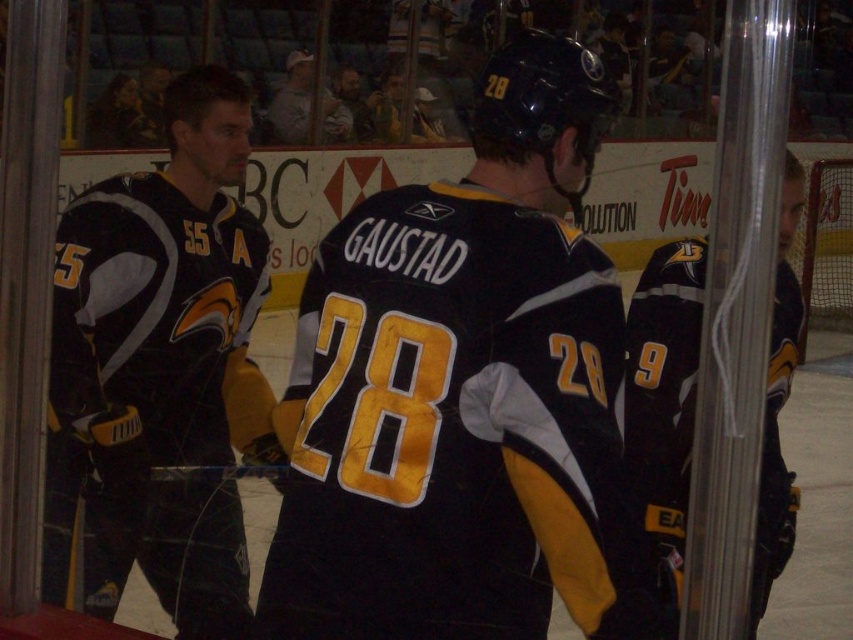
How distant is black matte jersey at right from gray cotton shirt at upper center?

black matte jersey at right is 8.76 meters from gray cotton shirt at upper center.

Who is higher up, black matte jersey at right or gray cotton shirt at upper center?

gray cotton shirt at upper center is above.

Is point (767, 483) positioned in front of point (306, 77)?

Yes, point (767, 483) is closer to viewer.

You are a GUI agent. You are given a task and a screenshot of the screen. Output one action in this format:
    pyautogui.click(x=<x>, y=<y>)
    Task: Click on the black matte jersey at right
    This screenshot has width=853, height=640.
    Given the screenshot: What is the action you would take?
    pyautogui.click(x=663, y=385)

Between black jersey at center and gray cotton shirt at upper center, which one appears on the right side from the viewer's perspective?

black jersey at center

Is black jersey at center closer to the viewer compared to gray cotton shirt at upper center?

Yes, black jersey at center is closer to the viewer.

At what (x,y) coordinates should I click in order to perform the action: click on black jersey at center. Please return your answer as a coordinate pair (x, y). The width and height of the screenshot is (853, 640). Looking at the image, I should click on (463, 394).

Is black jersey at center positioned in front of black jersey at left?

Yes, black jersey at center is closer to the viewer.

Between black jersey at center and black jersey at left, which one appears on the right side from the viewer's perspective?

black jersey at center is more to the right.

This screenshot has width=853, height=640. What do you see at coordinates (463, 394) in the screenshot?
I see `black jersey at center` at bounding box center [463, 394].

What are the coordinates of `black jersey at center` in the screenshot? It's located at (463, 394).